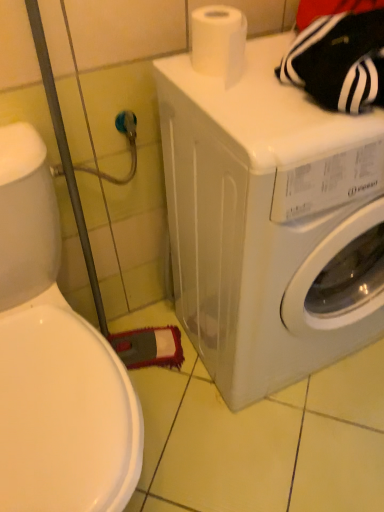
Locate an element on the screen. free space to the back side of white matte toilet paper at upper center is located at coordinates tap(250, 45).